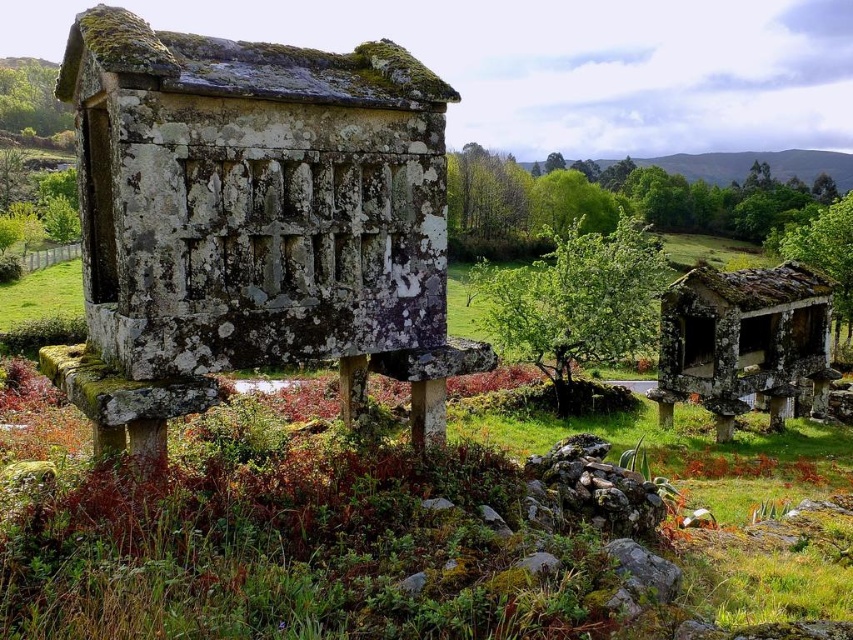
Is rusty metal hut at right to the left of green leafy bush at center from the viewer's perspective?

Indeed, rusty metal hut at right is positioned on the left side of green leafy bush at center.

Can you confirm if rusty metal hut at right is positioned below green leafy bush at center?

Indeed, rusty metal hut at right is positioned under green leafy bush at center.

At what (x,y) coordinates should I click in order to perform the action: click on rusty metal hut at right. Please return your answer as a coordinate pair (x, y). The image size is (853, 640). Looking at the image, I should click on (743, 340).

Which is above, speckled stone hut at center or rusty metal hut at right?

Positioned higher is speckled stone hut at center.

Is point (79, 29) closer to viewer compared to point (799, 339)?

Yes, it is.

The image size is (853, 640). Identify the location of speckled stone hut at center. (252, 221).

The image size is (853, 640). I want to click on speckled stone hut at center, so (252, 221).

Does speckled stone hut at center have a lesser width compared to green leafy bush at center?

Indeed, speckled stone hut at center has a lesser width compared to green leafy bush at center.

Identify the location of speckled stone hut at center. (252, 221).

The width and height of the screenshot is (853, 640). What do you see at coordinates (252, 221) in the screenshot?
I see `speckled stone hut at center` at bounding box center [252, 221].

This screenshot has height=640, width=853. What are the coordinates of `speckled stone hut at center` in the screenshot? It's located at (252, 221).